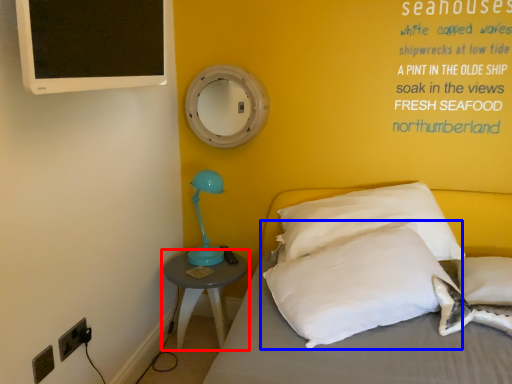
Question: Which point is further to the camera, nightstand (highlighted by a red box) or pillow (highlighted by a blue box)?

Choices:
 (A) nightstand
 (B) pillow

Answer: (A)